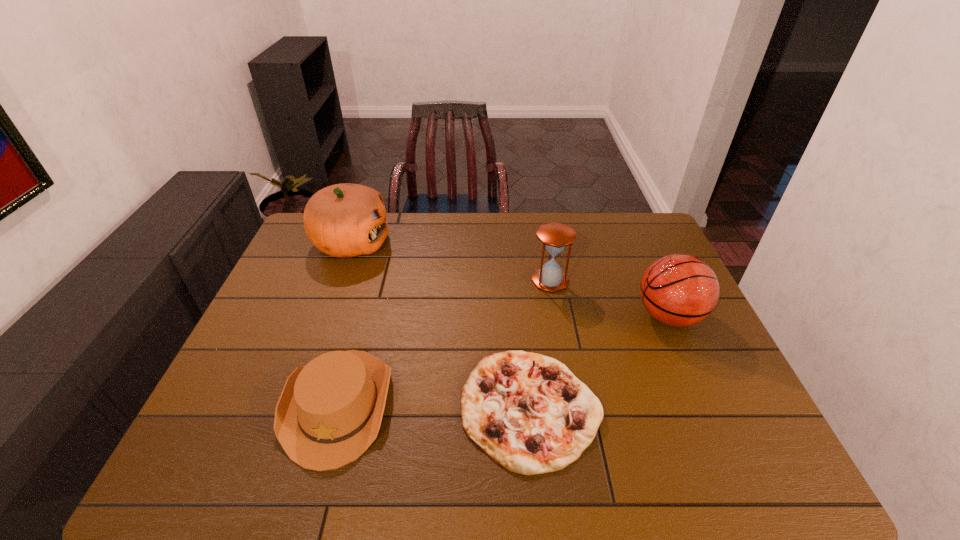
The width and height of the screenshot is (960, 540). I want to click on pumpkin, so click(344, 220).

Locate an element on the screen. The width and height of the screenshot is (960, 540). basketball is located at coordinates (680, 290).

Locate an element on the screen. The width and height of the screenshot is (960, 540). hourglass is located at coordinates (555, 237).

The image size is (960, 540). I want to click on cowboy hat, so click(329, 412).

At what (x,y) coordinates should I click in order to perform the action: click on the shortest object. Please return your answer as a coordinate pair (x, y). Looking at the image, I should click on (529, 413).

Where is `vacant space positioned 0.290m on the face of the farthest object`? The width and height of the screenshot is (960, 540). vacant space positioned 0.290m on the face of the farthest object is located at coordinates (473, 243).

Locate an element on the screen. vacant space positioned 0.200m on the side with spill of the basketball is located at coordinates (564, 316).

Find the location of a particular element. vacant space located 0.320m on the side with spill of the basketball is located at coordinates (522, 316).

What are the coordinates of `vacant position located on the side with spill of the basketball` in the screenshot? It's located at (533, 316).

I want to click on vacant space located 0.110m on the left of the hourglass, so click(x=496, y=280).